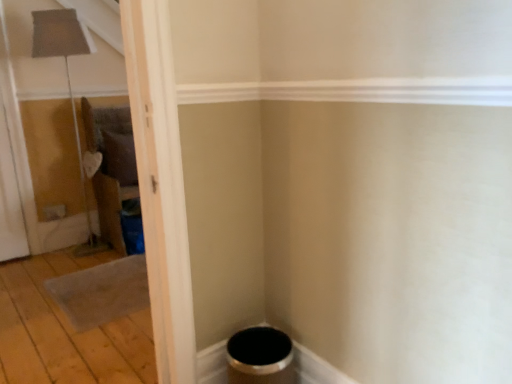
This screenshot has width=512, height=384. I want to click on wooden floor at lower left, so click(66, 331).

What do you see at coordinates (66, 331) in the screenshot? This screenshot has width=512, height=384. I see `wooden floor at lower left` at bounding box center [66, 331].

In order to click on transparent plastic screen door at left in this screenshot , I will do `click(10, 200)`.

The image size is (512, 384). What do you see at coordinates (10, 200) in the screenshot? I see `transparent plastic screen door at left` at bounding box center [10, 200].

Where is `wooden floor at lower left`? The width and height of the screenshot is (512, 384). wooden floor at lower left is located at coordinates (66, 331).

In the image, is transparent plastic screen door at left on the left side or the right side of wooden floor at lower left?

From the image, it's evident that transparent plastic screen door at left is to the left of wooden floor at lower left.

Considering the positions of objects transparent plastic screen door at left and wooden floor at lower left in the image provided, who is in front, transparent plastic screen door at left or wooden floor at lower left?

wooden floor at lower left is in front.

Is point (0, 152) positioned in front of point (51, 257)?

Yes.

From the image's perspective, is transparent plastic screen door at left located above or below wooden floor at lower left?

transparent plastic screen door at left is above wooden floor at lower left.

From a real-world perspective, which is physically above, transparent plastic screen door at left or wooden floor at lower left?

In real-world perspective, transparent plastic screen door at left is above.

Which object is thinner, transparent plastic screen door at left or wooden floor at lower left?

transparent plastic screen door at left is thinner.

Is transparent plastic screen door at left taller than wooden floor at lower left?

Correct, transparent plastic screen door at left is much taller as wooden floor at lower left.

Who is smaller, transparent plastic screen door at left or wooden floor at lower left?

transparent plastic screen door at left.

Is transparent plastic screen door at left inside or outside of wooden floor at lower left?

transparent plastic screen door at left is not inside wooden floor at lower left, it's outside.

Consider the image. Does transparent plastic screen door at left touch wooden floor at lower left?

transparent plastic screen door at left is not next to wooden floor at lower left, and they're not touching.

Is transparent plastic screen door at left looking in the opposite direction of wooden floor at lower left?

That's not correct — transparent plastic screen door at left is not looking away from wooden floor at lower left.

Consider the image. How many degrees apart are the facing directions of transparent plastic screen door at left and wooden floor at lower left?

1.92 degrees.

Image resolution: width=512 pixels, height=384 pixels. What are the coordinates of `screen door above the wooden floor at lower left (from the image's perspective)` in the screenshot? It's located at (10, 200).

Considering the positions of objects wooden floor at lower left and transparent plastic screen door at left in the image provided, who is more to the right, wooden floor at lower left or transparent plastic screen door at left?

From the viewer's perspective, wooden floor at lower left appears more on the right side.

Is wooden floor at lower left positioned in front of transparent plastic screen door at left?

Yes, wooden floor at lower left is in front of transparent plastic screen door at left.

Does point (109, 324) come closer to viewer compared to point (15, 203)?

Yes, it is.

From the image's perspective, is wooden floor at lower left located above or below transparent plastic screen door at left?

Clearly, from the image's perspective, wooden floor at lower left is below transparent plastic screen door at left.

From a real-world perspective, which object rests below the other?

wooden floor at lower left is physically lower.

Which object is thinner, wooden floor at lower left or transparent plastic screen door at left?

Thinner between the two is transparent plastic screen door at left.

Looking at this image, between wooden floor at lower left and transparent plastic screen door at left, which one has less height?

wooden floor at lower left.

Between wooden floor at lower left and transparent plastic screen door at left, which one has smaller size?

Smaller between the two is transparent plastic screen door at left.

Is wooden floor at lower left located outside transparent plastic screen door at left?

wooden floor at lower left lies outside transparent plastic screen door at left's area.

Is wooden floor at lower left with transparent plastic screen door at left?

No, wooden floor at lower left is not in contact with transparent plastic screen door at left.

Is wooden floor at lower left facing away from transparent plastic screen door at left?

wooden floor at lower left does not have its back to transparent plastic screen door at left.

How much distance is there between wooden floor at lower left and transparent plastic screen door at left?

A distance of 35.48 inches exists between wooden floor at lower left and transparent plastic screen door at left.

Find the location of a particular element. plywood below the transparent plastic screen door at left (from the image's perspective) is located at coordinates (66, 331).

I want to click on screen door above the wooden floor at lower left (from a real-world perspective), so click(x=10, y=200).

Identify the location of screen door above the wooden floor at lower left (from the image's perspective). The width and height of the screenshot is (512, 384). (10, 200).